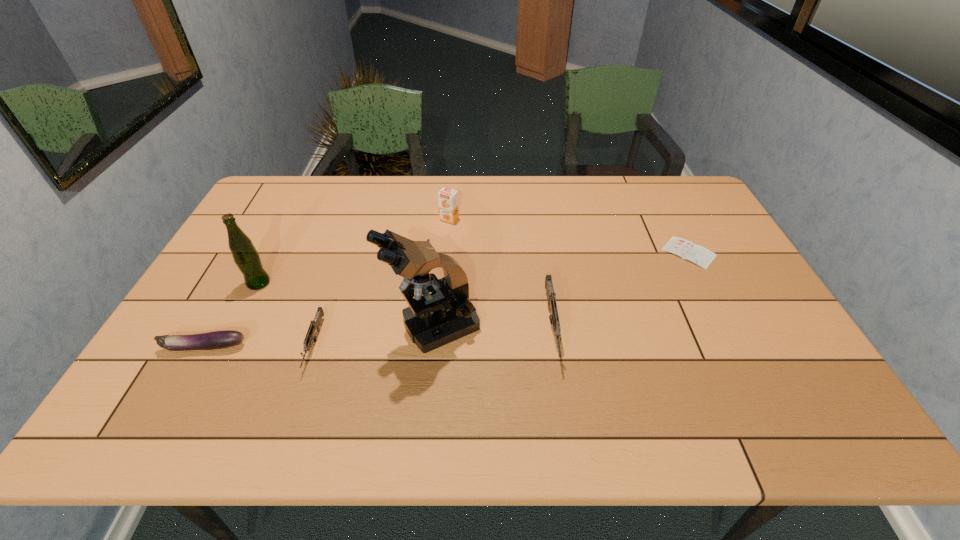
Please point a free position for a gun on the right. Please provide its 2D coordinates. Your answer should be formatted as a tuple, i.e. [(x, y)], where the tuple contains the x and y coordinates of a point satisfying the conditions above.

[(775, 312)]